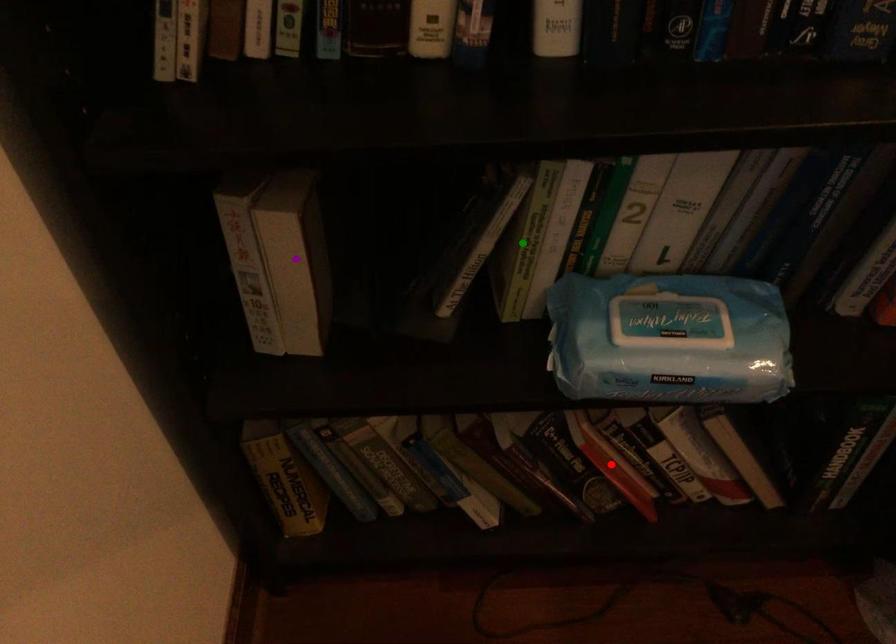
Order these from nearest to farthest:
purple point, red point, green point

purple point
green point
red point